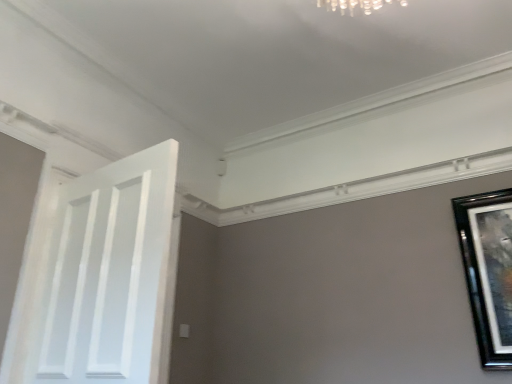
Question: Is black glossy picture frame at right positioned behind white painted wood door at left?

Choices:
 (A) yes
 (B) no

Answer: (A)

Question: Does black glossy picture frame at right lie in front of white painted wood door at left?

Choices:
 (A) yes
 (B) no

Answer: (B)

Question: Can you confirm if black glossy picture frame at right is smaller than white painted wood door at left?

Choices:
 (A) yes
 (B) no

Answer: (A)

Question: Can you confirm if black glossy picture frame at right is shorter than white painted wood door at left?

Choices:
 (A) yes
 (B) no

Answer: (A)

Question: From the image's perspective, is black glossy picture frame at right located beneath white painted wood door at left?

Choices:
 (A) no
 (B) yes

Answer: (B)

Question: Does black glossy picture frame at right have a greater width compared to white painted wood door at left?

Choices:
 (A) yes
 (B) no

Answer: (B)

Question: Is white painted wood door at left oriented towards black glossy picture frame at right?

Choices:
 (A) yes
 (B) no

Answer: (B)

Question: From the image's perspective, is white painted wood door at left located above black glossy picture frame at right?

Choices:
 (A) no
 (B) yes

Answer: (B)

Question: Considering the relative sizes of white painted wood door at left and black glossy picture frame at right in the image provided, is white painted wood door at left bigger than black glossy picture frame at right?

Choices:
 (A) no
 (B) yes

Answer: (B)

Question: Does white painted wood door at left have a smaller size compared to black glossy picture frame at right?

Choices:
 (A) no
 (B) yes

Answer: (A)

Question: Is white painted wood door at left positioned before black glossy picture frame at right?

Choices:
 (A) no
 (B) yes

Answer: (B)

Question: Considering the relative sizes of white painted wood door at left and black glossy picture frame at right in the image provided, is white painted wood door at left wider than black glossy picture frame at right?

Choices:
 (A) no
 (B) yes

Answer: (B)

Question: Considering the positions of white painted wood door at left and black glossy picture frame at right in the image, is white painted wood door at left bigger or smaller than black glossy picture frame at right?

Choices:
 (A) big
 (B) small

Answer: (A)